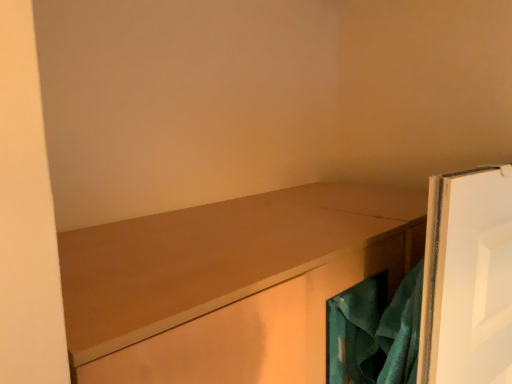
Question: Considering the positions of point (343, 360) and point (159, 283), is point (343, 360) closer or farther from the camera than point (159, 283)?

Choices:
 (A) closer
 (B) farther

Answer: (B)

Question: In the image, is teal fabric at right positioned in front of or behind matte wood cabinet at center?

Choices:
 (A) front
 (B) behind

Answer: (B)

Question: From a real-world perspective, relative to matte wood cabinet at center, is teal fabric at right vertically above or below?

Choices:
 (A) below
 (B) above

Answer: (B)

Question: From a real-world perspective, relative to teal fabric at right, is matte wood cabinet at center vertically above or below?

Choices:
 (A) below
 (B) above

Answer: (A)

Question: From the image's perspective, is matte wood cabinet at center located above or below teal fabric at right?

Choices:
 (A) above
 (B) below

Answer: (B)

Question: Is matte wood cabinet at center taller or shorter than teal fabric at right?

Choices:
 (A) short
 (B) tall

Answer: (B)

Question: Would you say matte wood cabinet at center is to the left or to the right of teal fabric at right in the picture?

Choices:
 (A) left
 (B) right

Answer: (A)